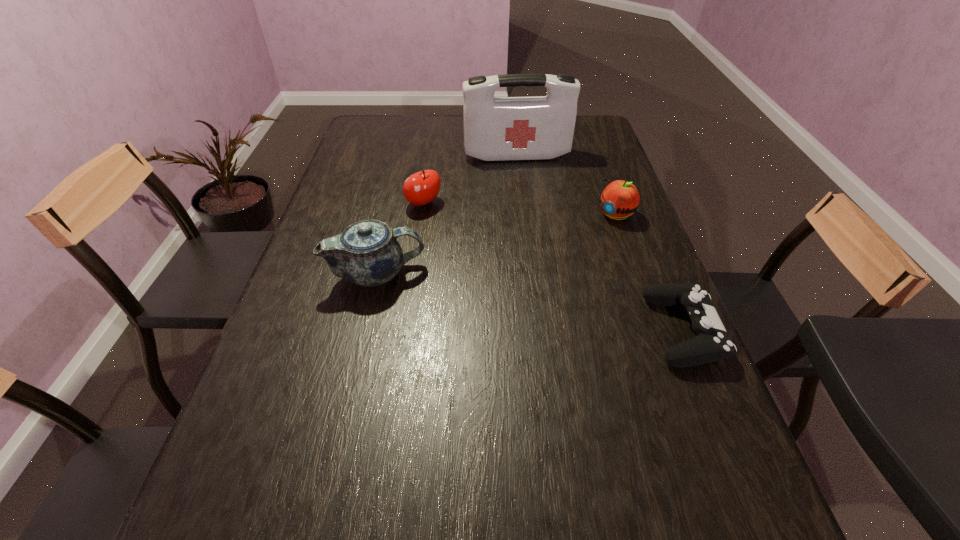
Where is `vacant position at the near edge of the desktop`? This screenshot has height=540, width=960. vacant position at the near edge of the desktop is located at coordinates (404, 449).

Image resolution: width=960 pixels, height=540 pixels. In the image, there is a desktop. In order to click on blank space at the right edge in this screenshot , I will do `click(684, 382)`.

Identify the location of free space at the near right corner of the desktop. This screenshot has height=540, width=960. (646, 453).

This screenshot has width=960, height=540. I want to click on vacant space that's between the right apple and the left apple, so click(519, 209).

Identify the location of empty location between the second tallest object and the left apple. This screenshot has width=960, height=540. (400, 239).

I want to click on vacant area that lies between the right apple and the third object from left to right, so click(x=565, y=185).

The width and height of the screenshot is (960, 540). I want to click on empty location between the left apple and the control, so click(554, 267).

You are a GUI agent. You are given a task and a screenshot of the screen. Output one action in this format:
    pyautogui.click(x=<x>, y=<y>)
    Task: Click on the free space between the fourth shortest object and the control
    The image size is (960, 540).
    Given the screenshot: What is the action you would take?
    pyautogui.click(x=531, y=302)

The image size is (960, 540). I want to click on free area in between the farthest object and the chinaware, so click(447, 214).

Locate an element on the screen. Image resolution: width=960 pixels, height=540 pixels. vacant space that is in between the left apple and the second tallest object is located at coordinates (400, 239).